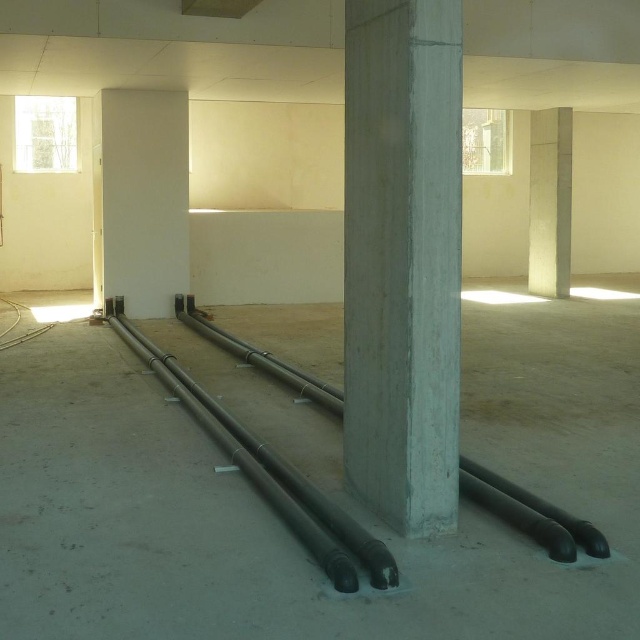
You are a construction worker standing at the entrance of the room. You need to move a heavy tool from the entrance to the black rubber pipe at center. Which direction should you move relative to the concrete at center to reach the pipe?

The concrete at center is to the right of the black rubber pipe at center, so to reach the pipe, you should move to the left of the concrete at center.

You are a construction worker standing at the entrance of the room. You need to move a tool from the entrance to the black rubber pipe at center. According to the coordinates provided, in which direction should you move relative to your starting position?

The black rubber pipe at center is located at coordinates point (285, 476), which means it is positioned to the right and slightly forward from your starting position at the entrance. Move right and forward to reach it.

You are a construction worker who needs to place a new pipe next to the existing ones. The new pipe has a width of 15 cm. Can you determine if the black rubber pipe at center is wider than the smooth concrete pillar at center based on the scene?

The black rubber pipe at center is wider than the smooth concrete pillar at center, so yes, the black rubber pipe at center is wider than the smooth concrete pillar at center.